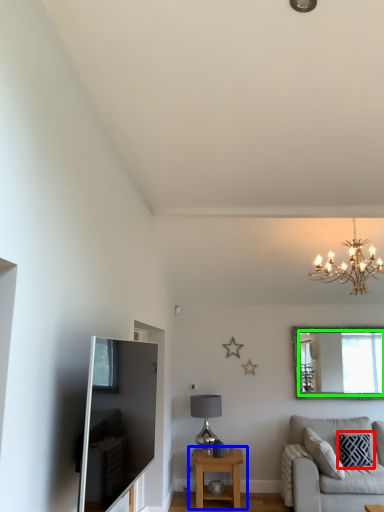
Question: Which is farther away from pillow (highlighted by a red box)? table (highlighted by a blue box) or mirror (highlighted by a green box)?

Choices:
 (A) table
 (B) mirror

Answer: (A)